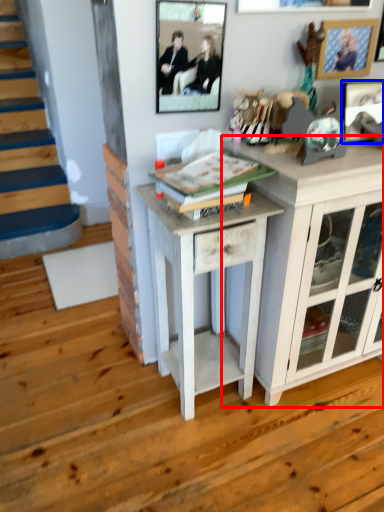
Question: Which object appears closest to the camera in this image, cabinetry (highlighted by a red box) or picture frame (highlighted by a blue box)?

Choices:
 (A) cabinetry
 (B) picture frame

Answer: (A)